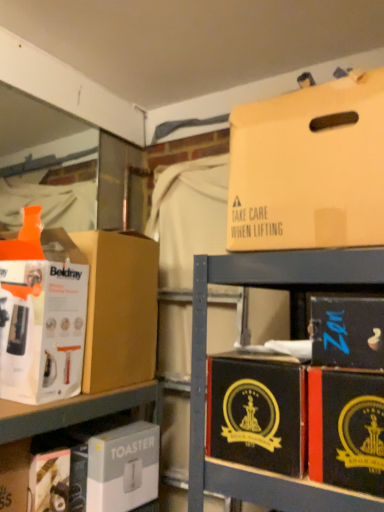
Question: Which is correct: white cardboard toaster at lower center, the 7th box viewed from the top, is inside black cardboard box at center right, the second box in the bottom-to-top sequence, or outside of it?

Choices:
 (A) outside
 (B) inside

Answer: (A)

Question: From a real-world perspective, is white cardboard toaster at lower center, the 1th box ordered from the bottom, positioned above or below black cardboard box at center right, the second box in the bottom-to-top sequence?

Choices:
 (A) above
 (B) below

Answer: (B)

Question: Based on their relative distances, which object is farther from the white cardboard box at lower left?

Choices:
 (A) matte cardboard box at left, arranged as the fourth box when viewed from the top
 (B) beige cardboard box at upper right, which is counted as the 7th box, starting from the bottom
 (C) black cardboard box at lower right, placed as the third box when sorted from bottom to top
 (D) white cardboard box at left, which is counted as the second box, starting from the top
 (E) black cardboard box at lower right, which ranks as the 5th box in bottom-to-top order

Answer: (B)

Question: Which is farther from the beige cardboard box at upper right, which is counted as the 7th box, starting from the bottom?

Choices:
 (A) black cardboard box at lower right, placed as the third box when sorted from bottom to top
 (B) white cardboard toaster at lower center, the 7th box viewed from the top
 (C) black cardboard box at center right, acting as the sixth box starting from the top
 (D) white cardboard box at left, which is counted as the second box, starting from the top
 (E) white cardboard box at lower left

Answer: (E)